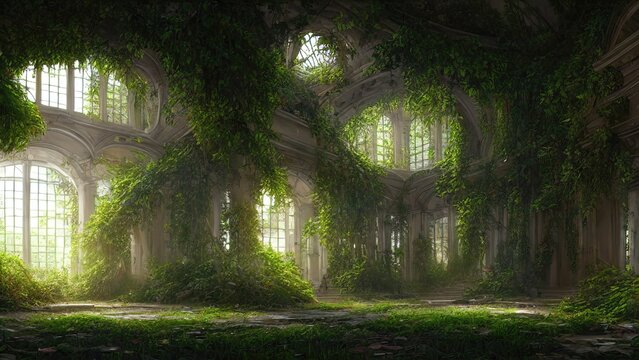
At what (x,y) coordinates should I click in order to perform the action: click on sunlight windows. Please return your answer as a coordinate pair (x, y). This screenshot has height=360, width=639. Looking at the image, I should click on (39, 223), (55, 71), (266, 221), (318, 45).